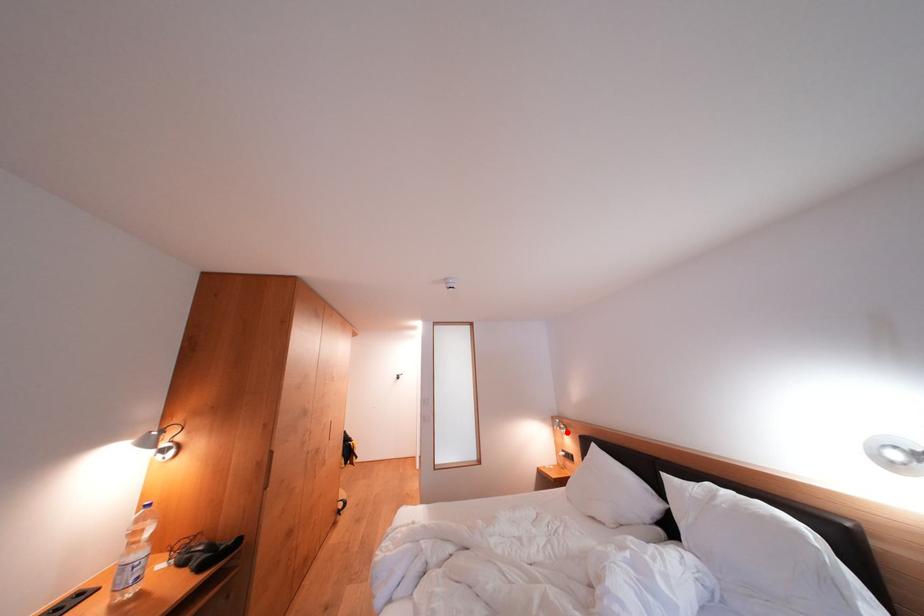
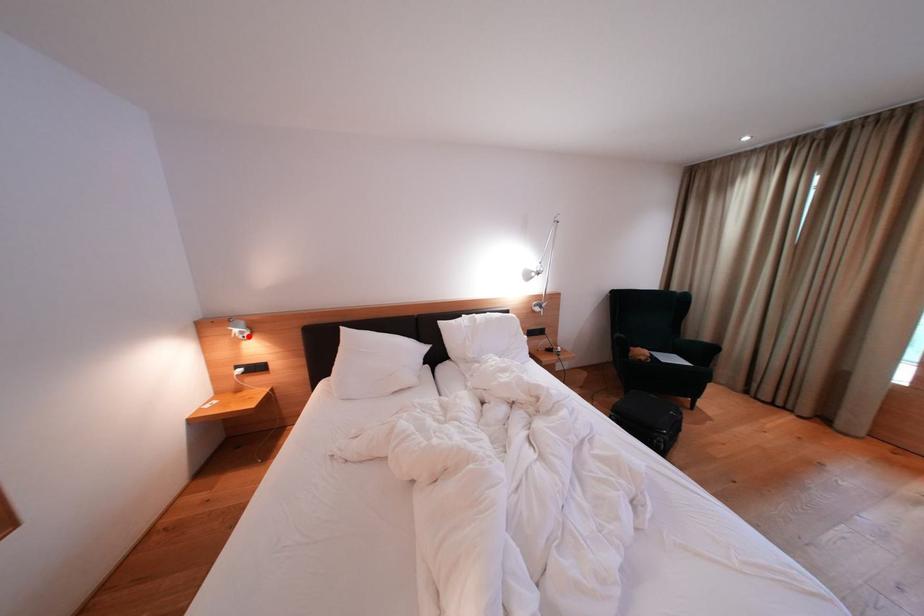
I am providing you with two images of the same scene from different viewpoints. A red point is marked on the first image and another point is marked on the second image. Is the marked point in image1 the same physical position as the marked point in image2?

Yes